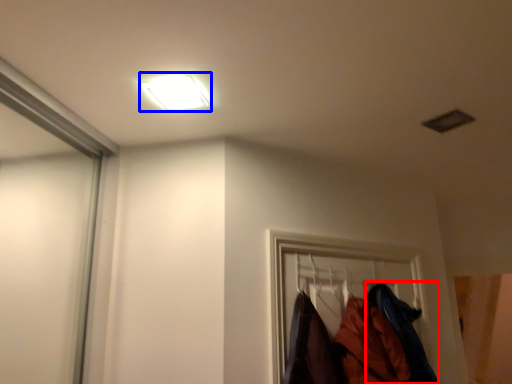
Question: Which object appears closest to the camera in this image, clothing (highlighted by a red box) or lamp (highlighted by a blue box)?

Choices:
 (A) clothing
 (B) lamp

Answer: (B)